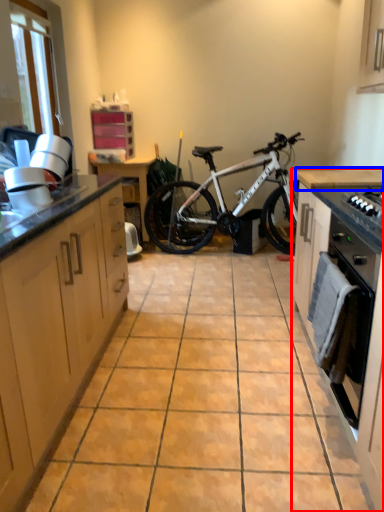
Question: Which object appears farthest to the camera in this image, cabinetry (highlighted by a red box) or counter top (highlighted by a blue box)?

Choices:
 (A) cabinetry
 (B) counter top

Answer: (B)